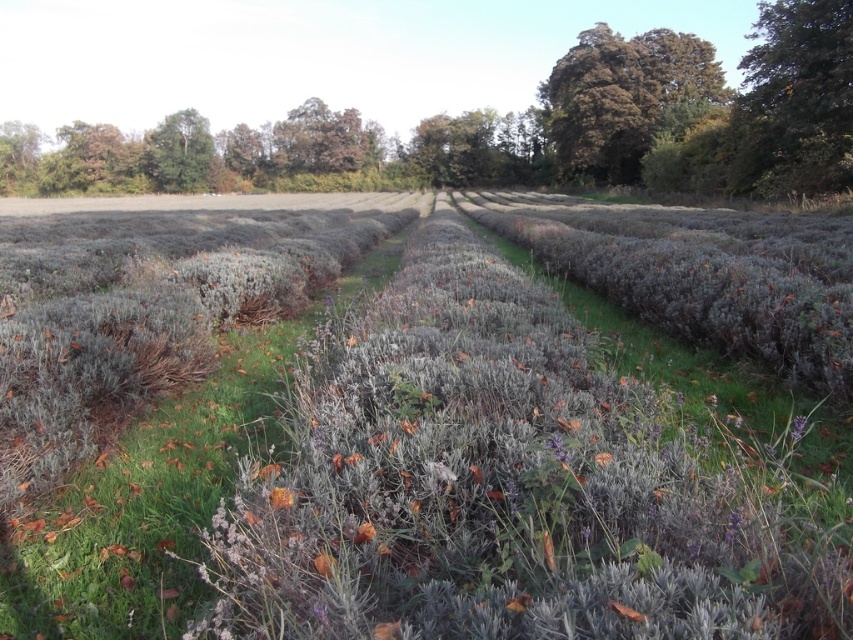
Which of these two, green leafy tree at upper right or orange matte flower at center, stands taller?

Standing taller between the two is green leafy tree at upper right.

Which is above, green leafy tree at upper right or orange matte flower at center?

green leafy tree at upper right is higher up.

Is point (849, 144) in front of point (287, 496)?

No, it is not.

The height and width of the screenshot is (640, 853). Find the location of `green leafy tree at upper right`. green leafy tree at upper right is located at coordinates (793, 100).

Does green leafy tree at upper right appear over purple fuzzy flower at center?

Indeed, green leafy tree at upper right is positioned over purple fuzzy flower at center.

Who is more distant from viewer, [799,4] or [361,525]?

The point [799,4] is more distant.

Does point (834, 68) come in front of point (367, 524)?

No, (834, 68) is behind (367, 524).

This screenshot has width=853, height=640. Identify the location of green leafy tree at upper right. (793, 100).

Does gray fuzzy bush at center have a lesser width compared to green leafy tree at upper right?

Indeed, gray fuzzy bush at center has a lesser width compared to green leafy tree at upper right.

Does gray fuzzy bush at center have a greater height compared to green leafy tree at upper right?

In fact, gray fuzzy bush at center may be shorter than green leafy tree at upper right.

Is point (688, 554) positioned after point (790, 33)?

No, it is not.

Find the location of a particular element. The height and width of the screenshot is (640, 853). gray fuzzy bush at center is located at coordinates (495, 486).